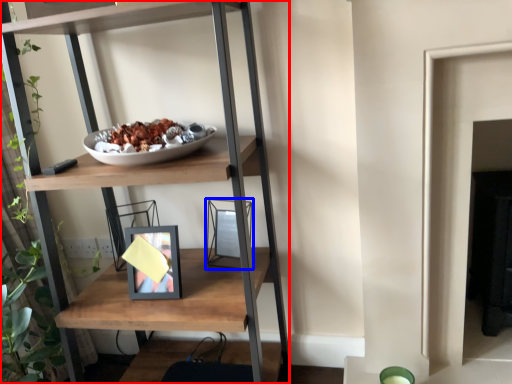
Question: Which point is further to the camera, shelf (highlighted by a red box) or picture frame (highlighted by a blue box)?

Choices:
 (A) shelf
 (B) picture frame

Answer: (B)